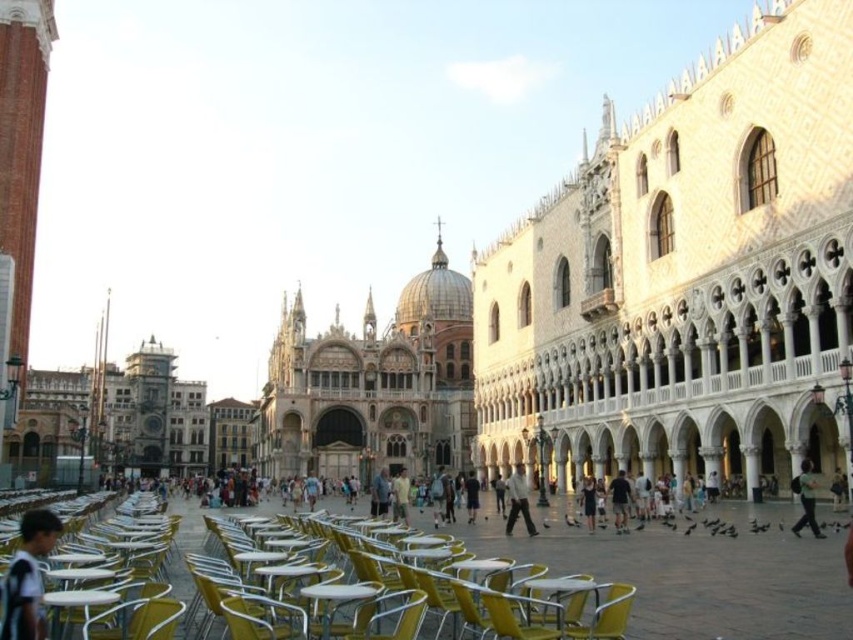
Is point (154, 612) in front of point (329, 596)?

Yes, it is.

Which is behind, point (86, 628) or point (341, 589)?

Point (341, 589)

What do you see at coordinates (135, 620) in the screenshot? I see `yellow plastic chair at lower left` at bounding box center [135, 620].

Locate an element on the screen. yellow plastic chair at lower left is located at coordinates (135, 620).

Between white stone building at center and dark gray feathered pigeon at center, which one has less height?

With less height is dark gray feathered pigeon at center.

Is point (548, 269) farther from viewer compared to point (566, 515)?

Yes, point (548, 269) is farther from viewer.

What do you see at coordinates (685, 275) in the screenshot? This screenshot has height=640, width=853. I see `white stone building at center` at bounding box center [685, 275].

This screenshot has height=640, width=853. In order to click on white stone building at center in this screenshot , I will do `click(685, 275)`.

Between point (13, 582) and point (595, 502), which one is positioned in front?

Point (13, 582) is more forward.

Who is higher up, white striped shirt at lower left or dark gray dress at center?

white striped shirt at lower left is above.

The width and height of the screenshot is (853, 640). What do you see at coordinates (27, 577) in the screenshot? I see `white striped shirt at lower left` at bounding box center [27, 577].

The width and height of the screenshot is (853, 640). I want to click on white striped shirt at lower left, so click(27, 577).